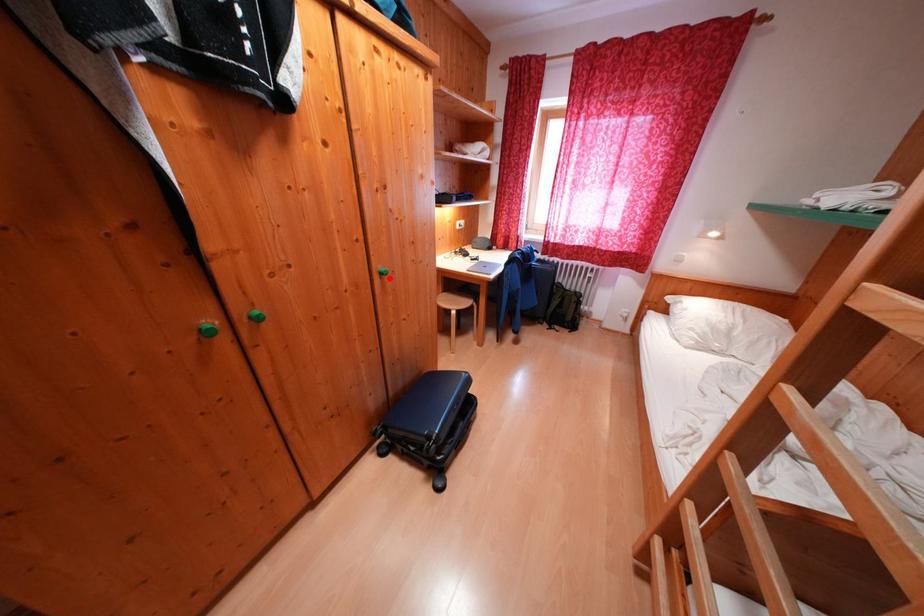
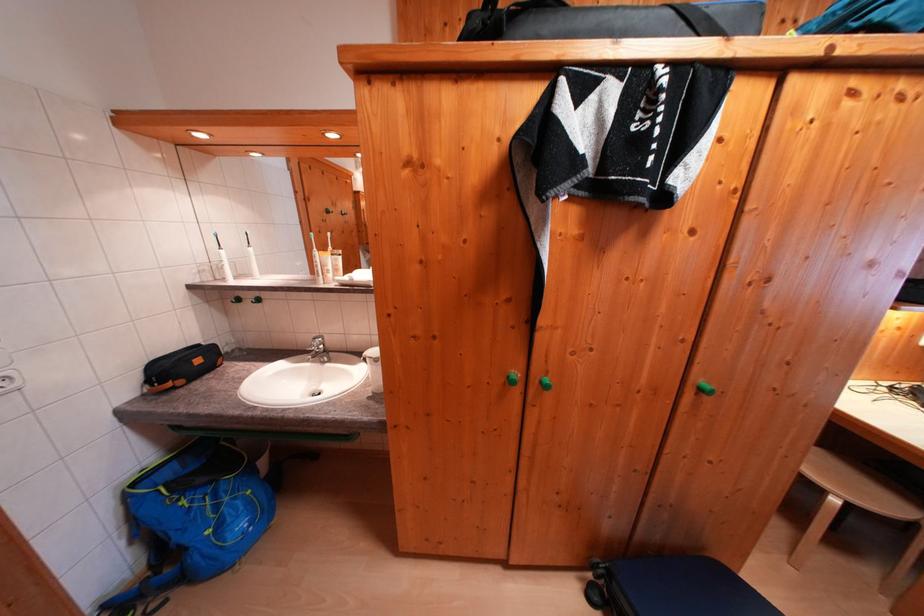
Locate, in the second image, the point that corresponds to the highlighted location in the first image.

(709, 394)